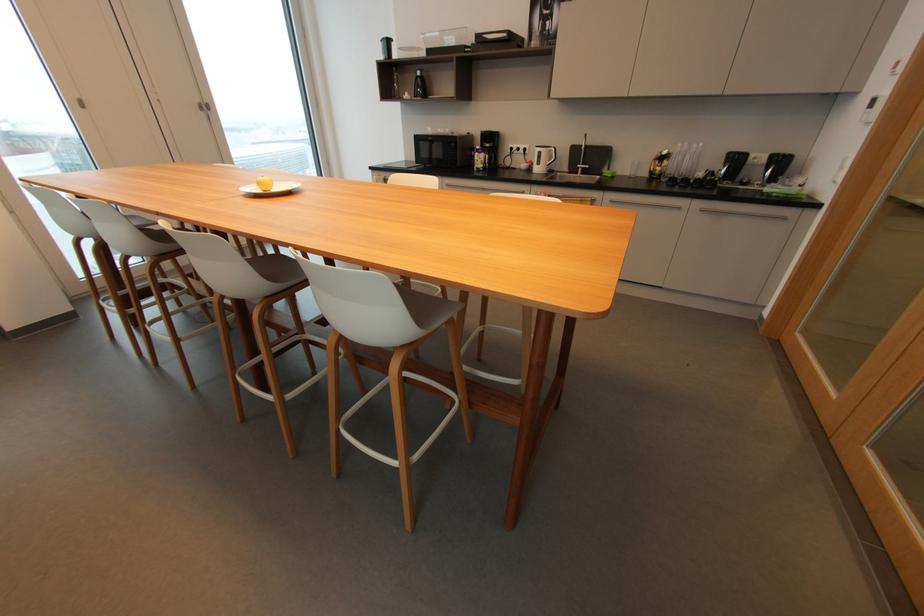
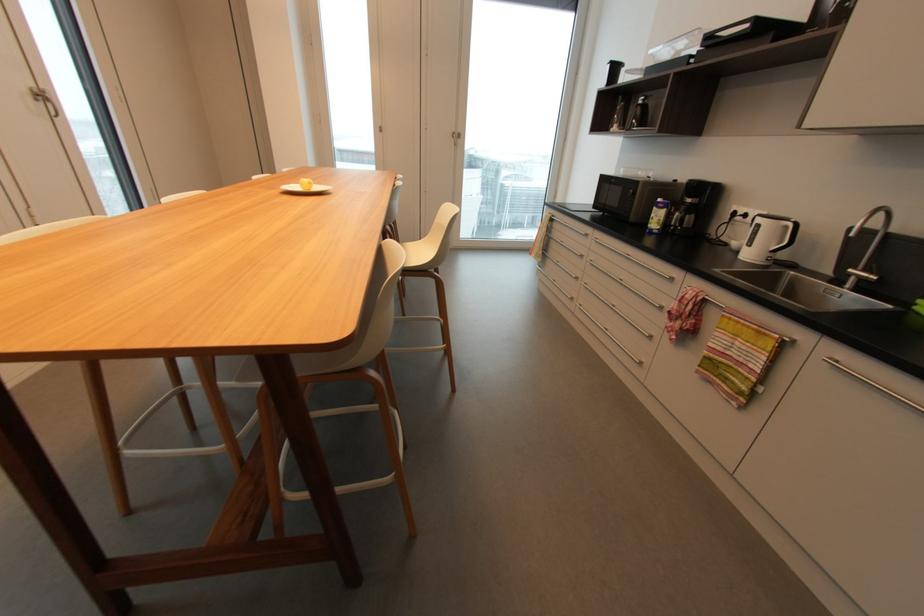
Question: I am providing you with two images of the same scene from different viewpoints. After the viewpoint changes to image2, which objects are now occluded?

Choices:
 (A) metal faucet handle
 (B) black microwave handle
 (C) yellow apple
 (D) none of these

Answer: (D)